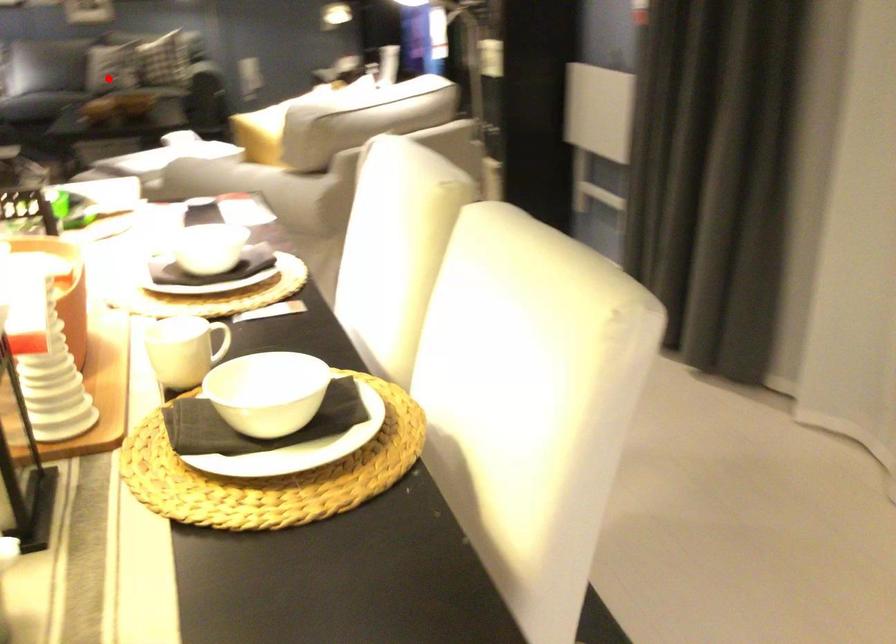
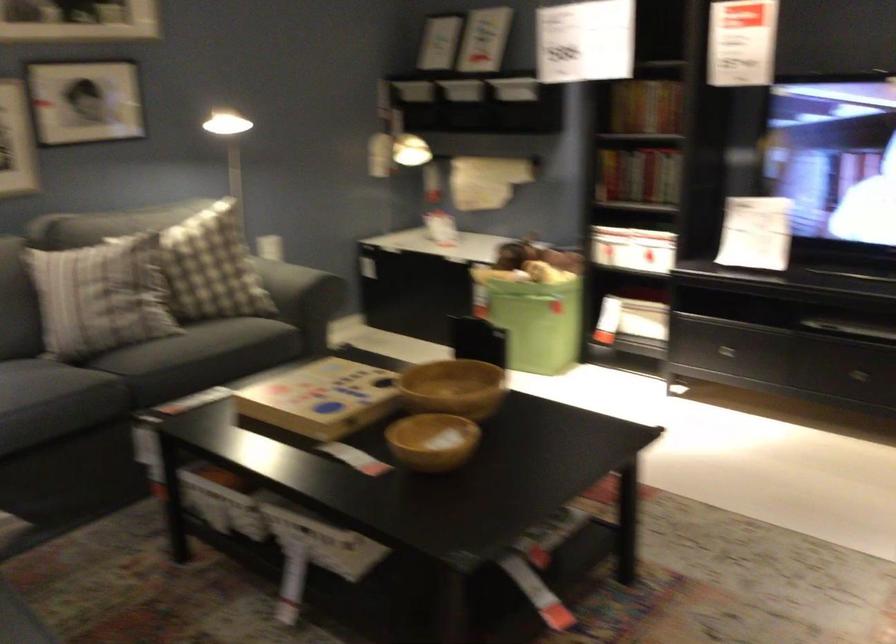
Question: I am providing you with two images of the same scene from different viewpoints. Given a red point in image1, look at the same physical point in image2. Is it:

Choices:
 (A) Closer to the viewpoint
 (B) Farther from the viewpoint

Answer: (A)